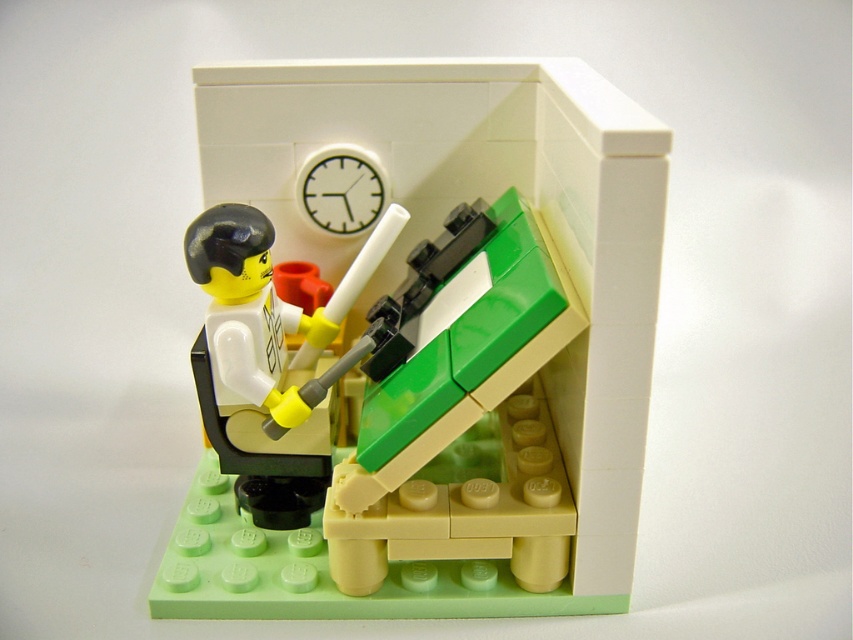
You are navigating a small robot through a LEGO office scene. The robot must move from the starting point at point (x=341, y=188) to the target point at (x=306, y=470). Is the target point in front of the starting point from the robot perspective?

Yes, the target point at point (x=306, y=470) is in front of the starting point at point (x=341, y=188) according to the description.